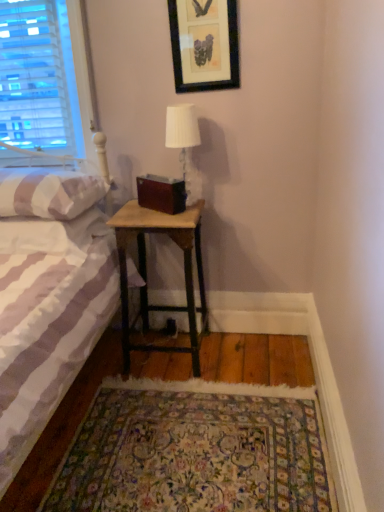
What do you see at coordinates (48, 319) in the screenshot?
I see `white striped fabric bed at left` at bounding box center [48, 319].

What is the approximate width of black framed picture at upper center?

black framed picture at upper center is 1.61 inches in width.

This screenshot has height=512, width=384. I want to click on floral carpet at lower center, so click(x=195, y=450).

Can you confirm if black framed picture at upper center is shorter than white striped pillow at left?

No, black framed picture at upper center is not shorter than white striped pillow at left.

Between black framed picture at upper center and white striped pillow at left, which one appears on the left side from the viewer's perspective?

From the viewer's perspective, white striped pillow at left appears more on the left side.

Does black framed picture at upper center have a greater width compared to white striped pillow at left?

In fact, black framed picture at upper center might be narrower than white striped pillow at left.

How different are the orientations of black framed picture at upper center and white striped pillow at left in degrees?

The facing directions of black framed picture at upper center and white striped pillow at left are 1.59 degrees apart.

Would you consider black framed picture at upper center to be distant from floral carpet at lower center?

That's right, there is a large distance between black framed picture at upper center and floral carpet at lower center.

Is point (201, 86) positioned behind point (145, 500)?

Yes.

Is black framed picture at upper center located outside floral carpet at lower center?

Yes.

Find the location of `mat in front of the black framed picture at upper center`. mat in front of the black framed picture at upper center is located at coordinates point(195,450).

Does woodenmaterial/texturenightstand at lower center contain white fabric lampshade at upper center?

No, white fabric lampshade at upper center is not a part of woodenmaterial/texturenightstand at lower center.

In the image, there is a white fabric lampshade at upper center. At what (x,y) coordinates should I click in order to perform the action: click on nightstand below it (from the image's perspective). Please return your answer as a coordinate pair (x, y). This screenshot has height=512, width=384. Looking at the image, I should click on (146, 271).

Is woodenmaterial/texturenightstand at lower center further to the viewer compared to white fabric lampshade at upper center?

No, it is not.

Which of these two, white striped pillow at left or floral carpet at lower center, is smaller?

Smaller between the two is white striped pillow at left.

Who is taller, white striped pillow at left or floral carpet at lower center?

white striped pillow at left.

From a real-world perspective, between white striped pillow at left and floral carpet at lower center, who is vertically lower?

floral carpet at lower center.

Which is correct: white striped pillow at left is inside floral carpet at lower center, or outside of it?

white striped pillow at left is not enclosed by floral carpet at lower center.

Between black framed picture at upper center and woodenmaterial/texturenightstand at lower center, which one has less height?

black framed picture at upper center is shorter.

Would you consider black framed picture at upper center to be distant from woodenmaterial/texturenightstand at lower center?

No, black framed picture at upper center is not far from woodenmaterial/texturenightstand at lower center.

Which object is closer to the camera taking this photo, black framed picture at upper center or woodenmaterial/texturenightstand at lower center?

black framed picture at upper center is more forward.

Is black framed picture at upper center wider than woodenmaterial/texturenightstand at lower center?

Incorrect, the width of black framed picture at upper center does not surpass that of woodenmaterial/texturenightstand at lower center.

Locate an element on the screen. The image size is (384, 512). mat below the woodenmaterial/texturenightstand at lower center (from a real-world perspective) is located at coordinates (195, 450).

From the image's perspective, is floral carpet at lower center beneath woodenmaterial/texturenightstand at lower center?

Yes, from the image's perspective, floral carpet at lower center is below woodenmaterial/texturenightstand at lower center.

From a real-world perspective, which object stands above the other?

woodenmaterial/texturenightstand at lower center is physically above.

Is floral carpet at lower center closer to the viewer compared to woodenmaterial/texturenightstand at lower center?

That is True.

From a real-world perspective, is woodenmaterial/texturenightstand at lower center under white striped pillow at left?

Correct, in the physical world, woodenmaterial/texturenightstand at lower center is lower than white striped pillow at left.

Considering the sizes of objects woodenmaterial/texturenightstand at lower center and white striped pillow at left in the image provided, who is bigger, woodenmaterial/texturenightstand at lower center or white striped pillow at left?

woodenmaterial/texturenightstand at lower center.

Considering the sizes of objects woodenmaterial/texturenightstand at lower center and white striped pillow at left in the image provided, who is thinner, woodenmaterial/texturenightstand at lower center or white striped pillow at left?

woodenmaterial/texturenightstand at lower center.

You are a GUI agent. You are given a task and a screenshot of the screen. Output one action in this format:
    pyautogui.click(x=<x>, y=<y>)
    Task: Click on the pillow that appears above the woodenmaterial/texturenightstand at lower center (from the image's perspective)
    This screenshot has height=512, width=384.
    Given the screenshot: What is the action you would take?
    pyautogui.click(x=48, y=192)

Identify the location of pillow that appears below the black framed picture at upper center (from the image's perspective). This screenshot has width=384, height=512. (48, 192).

You are a GUI agent. You are given a task and a screenshot of the screen. Output one action in this format:
    pyautogui.click(x=<x>, y=<y>)
    Task: Click on the picture frame above the floral carpet at lower center (from the image's perspective)
    
    Given the screenshot: What is the action you would take?
    pyautogui.click(x=204, y=44)

Estimate the real-world distances between objects in this image. Which object is further from white striped fabric bed at left, white striped pillow at left or white fabric lampshade at upper center?

Among the two, white fabric lampshade at upper center is located further to white striped fabric bed at left.

From the image, which object appears to be nearer to white fabric lampshade at upper center, white striped fabric bed at left or black framed picture at upper center?

black framed picture at upper center is closer to white fabric lampshade at upper center.

Looking at the image, which one is located further to white striped pillow at left, black framed picture at upper center or floral carpet at lower center?

The object further to white striped pillow at left is floral carpet at lower center.

When comparing their distances from white striped pillow at left, does black framed picture at upper center or white fabric lampshade at upper center seem further?

black framed picture at upper center.

From the image, which object appears to be nearer to white fabric lampshade at upper center, white striped fabric bed at left or white striped pillow at left?

Based on the image, white striped pillow at left appears to be nearer to white fabric lampshade at upper center.

Estimate the real-world distances between objects in this image. Which object is closer to white fabric lampshade at upper center, black framed picture at upper center or white striped fabric bed at left?

black framed picture at upper center.

From the image, which object appears to be nearer to floral carpet at lower center, white striped fabric bed at left or white fabric lampshade at upper center?

Based on the image, white striped fabric bed at left appears to be nearer to floral carpet at lower center.

Looking at the image, which one is located closer to white striped fabric bed at left, white striped pillow at left or black framed picture at upper center?

Based on the image, white striped pillow at left appears to be nearer to white striped fabric bed at left.

I want to click on pillow located between white striped fabric bed at left and white fabric lampshade at upper center in the depth direction, so click(48, 192).

Find the location of a particular element. nightstand between white striped pillow at left and floral carpet at lower center in the up-down direction is located at coordinates (146, 271).

This screenshot has width=384, height=512. I want to click on pillow between black framed picture at upper center and floral carpet at lower center vertically, so click(48, 192).

Where is `nightstand between black framed picture at upper center and floral carpet at lower center in the vertical direction`? Image resolution: width=384 pixels, height=512 pixels. nightstand between black framed picture at upper center and floral carpet at lower center in the vertical direction is located at coordinates click(x=146, y=271).